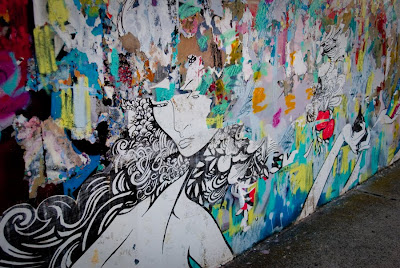
You are a GUI agent. You are given a task and a screenshot of the screen. Output one action in this format:
    pyautogui.click(x=<x>, y=<y>)
    Task: Click on the purple paint
    
    Given the screenshot: What is the action you would take?
    pyautogui.click(x=275, y=120), pyautogui.click(x=280, y=51), pyautogui.click(x=194, y=28), pyautogui.click(x=10, y=73), pyautogui.click(x=19, y=106)